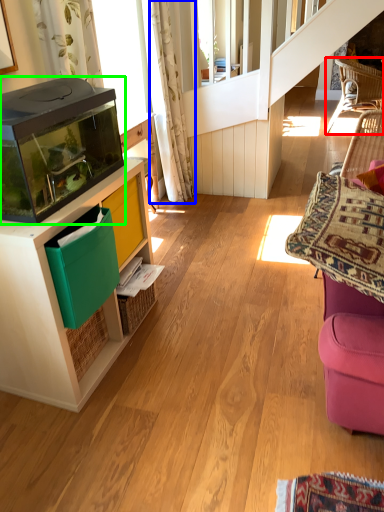
Question: Estimate the real-world distances between objects in this image. Which object is closer to chair (highlighted by a red box), curtain (highlighted by a blue box) or appliance (highlighted by a green box)?

Choices:
 (A) curtain
 (B) appliance

Answer: (A)